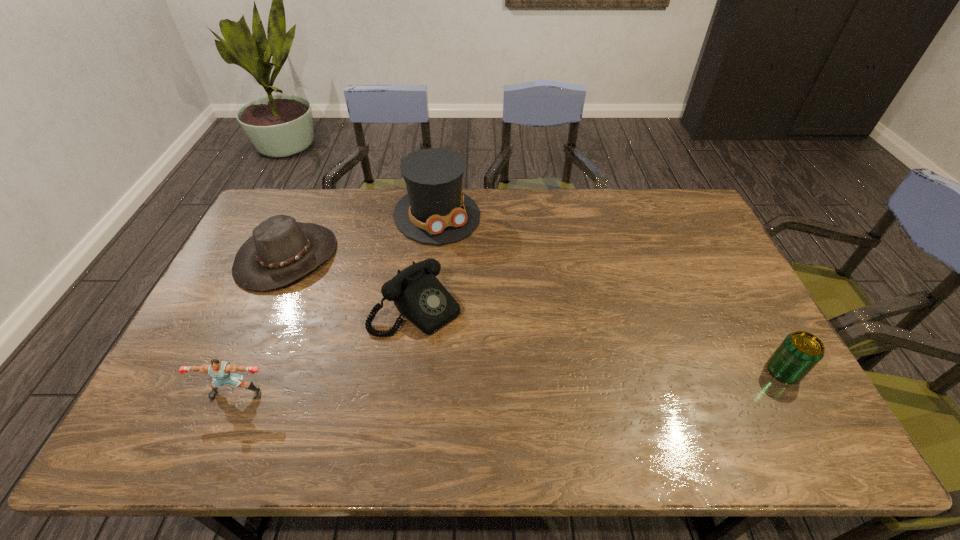
I want to click on vacant point located 0.280m with goggles on the front of the dress hat, so click(x=497, y=298).

Identify the location of vacant space located with goggles on the front of the dress hat. (513, 320).

Find the location of a particular element. free space located on the front-facing side of the hat is located at coordinates (387, 320).

Where is `vacant space located 0.230m on the front-facing side of the hat`? This screenshot has width=960, height=540. vacant space located 0.230m on the front-facing side of the hat is located at coordinates (372, 310).

You are a GUI agent. You are given a task and a screenshot of the screen. Output one action in this format:
    pyautogui.click(x=<x>, y=<y>)
    Task: Click on the vacant region located 0.110m on the front-facing side of the hat
    This screenshot has height=540, width=960.
    Given the screenshot: What is the action you would take?
    pyautogui.click(x=343, y=292)

Find the location of a particular element. This screenshot has width=960, height=540. dress hat present at the far edge is located at coordinates (435, 211).

I want to click on hat that is positioned at the far edge, so click(x=281, y=250).

Identify the location of puncher located in the near edge section of the desktop. The height and width of the screenshot is (540, 960). (223, 372).

Locate an element on the screen. The width and height of the screenshot is (960, 540). beer can that is at the near edge is located at coordinates (799, 352).

You are a GUI agent. You are given a task and a screenshot of the screen. Output one action in this format:
    pyautogui.click(x=<x>, y=<y>)
    Task: Click on the puncher that is at the left edge
    Image resolution: width=960 pixels, height=540 pixels.
    Given the screenshot: What is the action you would take?
    pyautogui.click(x=223, y=372)